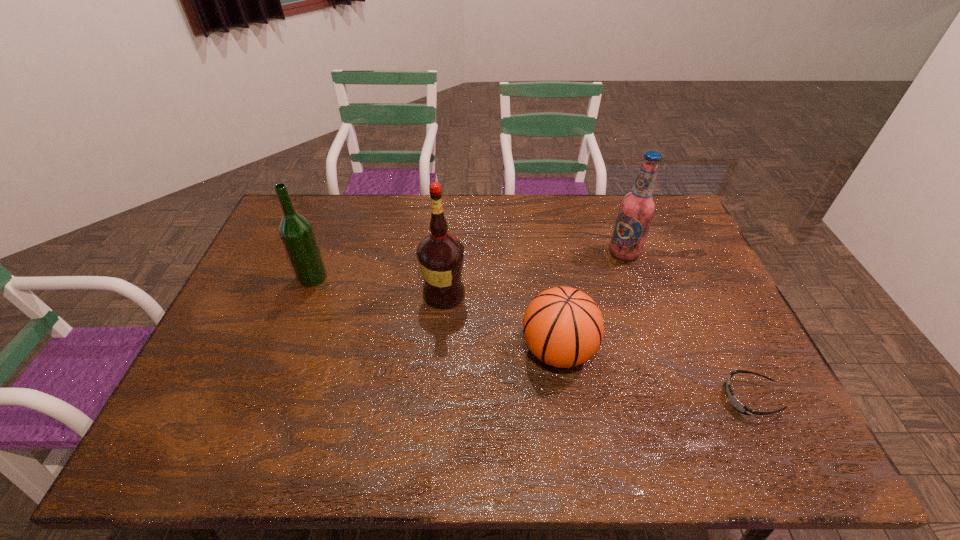
Find the location of a particular element. This screenshot has height=540, width=960. free space located on the right of the leftmost object is located at coordinates (436, 277).

The height and width of the screenshot is (540, 960). Identify the location of free space located on the right of the basketball. (643, 350).

Locate an element on the screen. free space located 0.320m on the lenses of the rightmost object is located at coordinates click(594, 398).

This screenshot has height=540, width=960. What are the coordinates of `blank area located 0.380m on the lenses of the rightmost object` in the screenshot? It's located at (570, 398).

Where is `vacant area situated on the lenses of the rightmost object`? This screenshot has height=540, width=960. vacant area situated on the lenses of the rightmost object is located at coordinates (655, 398).

Image resolution: width=960 pixels, height=540 pixels. Identify the location of object positioned at the left edge. (296, 232).

Where is `object at the right edge`? object at the right edge is located at coordinates (736, 404).

At what (x,y) coordinates should I click in order to perform the action: click on free spot at the far edge of the desktop. Please return your answer as a coordinate pair (x, y). This screenshot has width=960, height=540. Looking at the image, I should click on (522, 204).

Locate an element on the screen. Image resolution: width=960 pixels, height=540 pixels. free space at the left edge is located at coordinates (251, 392).

Find the location of a particular element. The height and width of the screenshot is (540, 960). vacant space at the far left corner of the desktop is located at coordinates (317, 200).